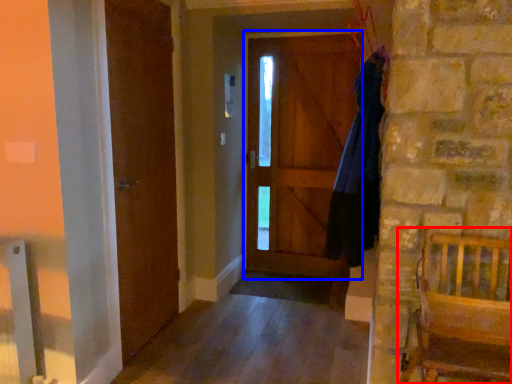
Question: Among these objects, which one is nearest to the camera, furniture (highlighted by a red box) or screen door (highlighted by a blue box)?

Choices:
 (A) furniture
 (B) screen door

Answer: (A)